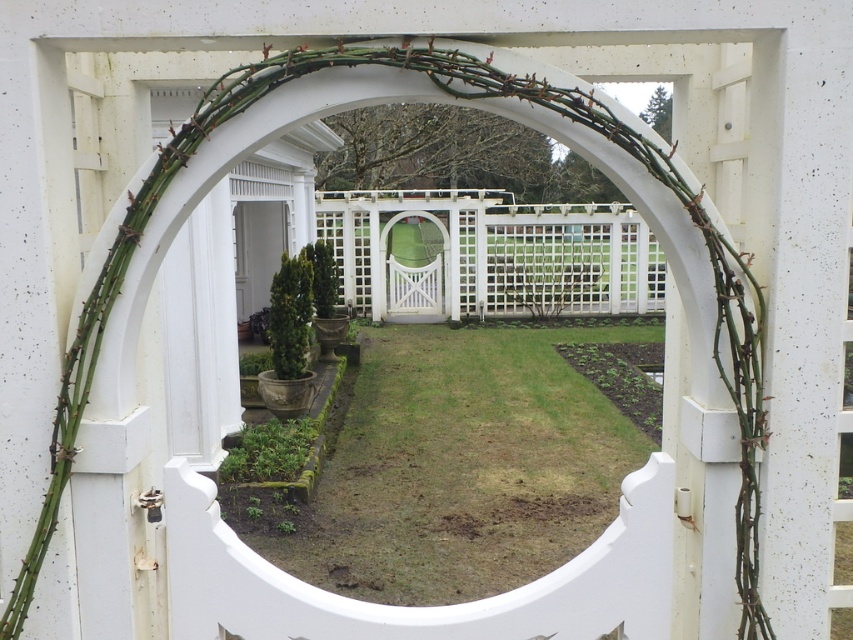
Between point (315, 232) and point (241, 234), which one is positioned in front?

Point (241, 234) is more forward.

Which of these two, white lattice fence at center or white glossy door at center, stands taller?

white lattice fence at center is taller.

You are a GUI agent. You are given a task and a screenshot of the screen. Output one action in this format:
    pyautogui.click(x=<x>, y=<y>)
    Task: Click on the white lattice fence at center
    The width and height of the screenshot is (853, 640).
    Given the screenshot: What is the action you would take?
    pyautogui.click(x=486, y=257)